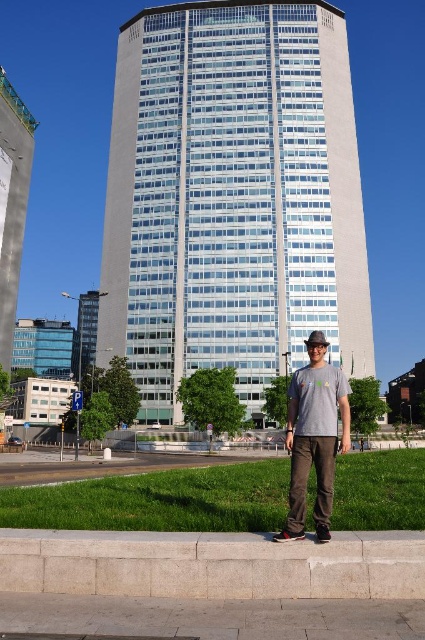
You are standing at the point labeled as point (311,356) in the image. You want to take a photo of the tall modern building with the glass facade. If your camera can focus on objects up to 25 meters away, will you be able to capture the building clearly?

The distance between point (311,356) and the camera is 20.16 meters, which is within the camera focus range of 25 meters. Therefore, you can capture the building clearly.

You are a delivery person trying to park your 2.5 meter wide truck between the gray concrete curb at lower center and the white glass building at left. Can you fit your truck there?

The gray concrete curb at lower center is smaller than the white glass building at left, but the description does not provide specific measurements of the space between them. Therefore, it is unclear if the truck will fit.

Based on the photo, you are a photographer trying to capture a photo of the glassy white building at center and the white glass building at left. Which building should you focus on first if you want to ensure both are in focus without adjusting your camera settings?

You should focus on the glassy white building at center first because it is closer to you than the white glass building at left, so focusing on the closer one will help keep both in focus when using a narrow aperture or sufficient depth of field.